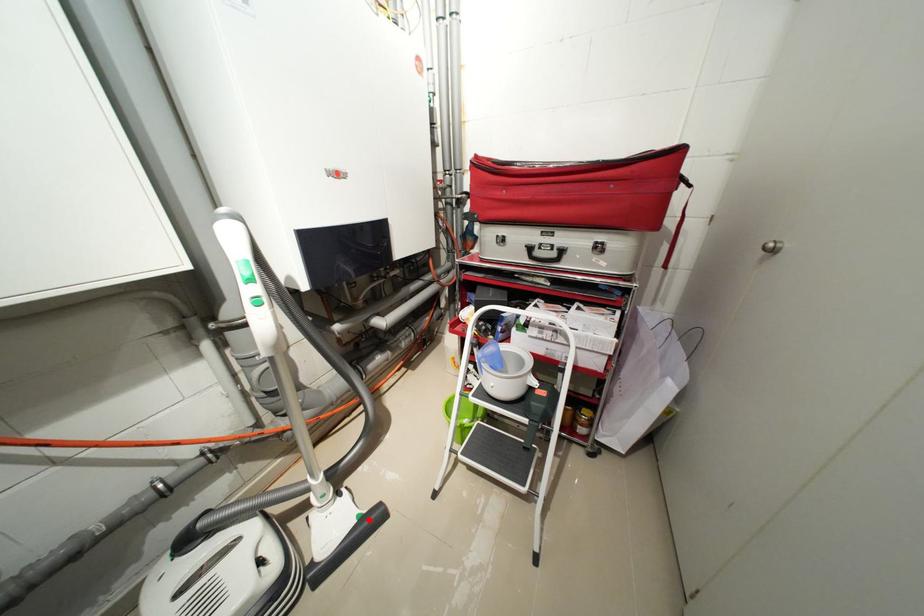
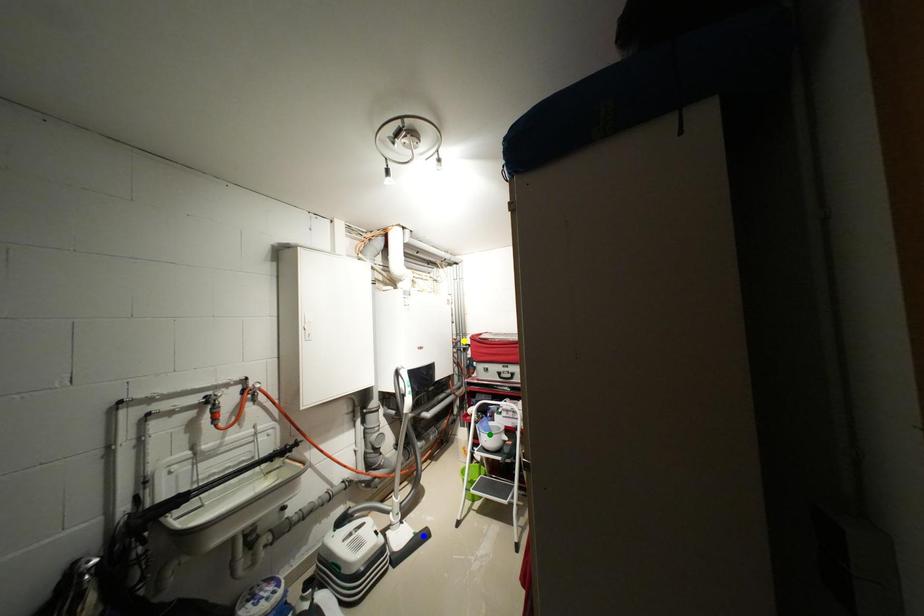
Question: I am providing you with two images of the same scene from different viewpoints. A red point is marked on the first image. You are given multiple points on the second image. Can you choose the point in image 2 that corresponds to the point in image 1?

Choices:
 (A) green point
 (B) blue point
 (C) yellow point

Answer: (B)